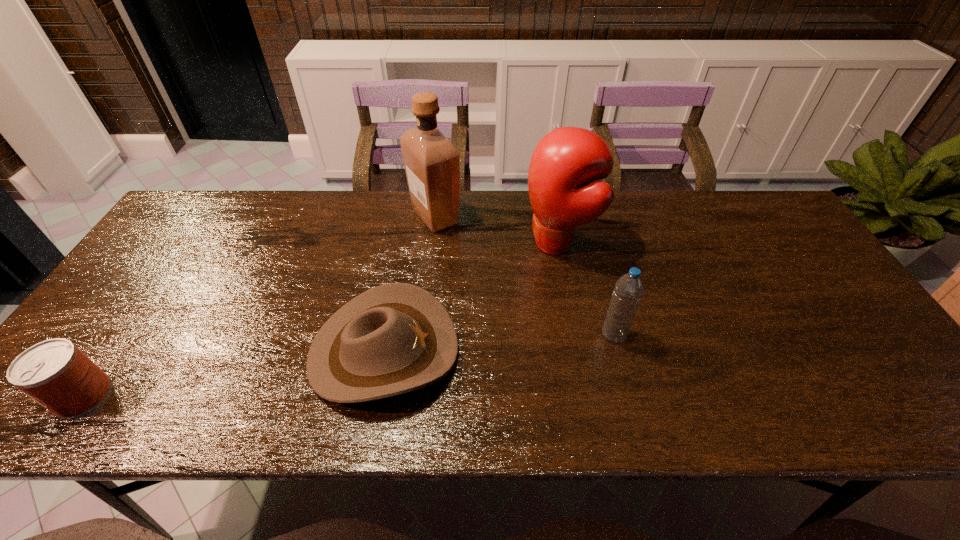
The image size is (960, 540). What are the coordinates of `liquor` in the screenshot? It's located at (432, 162).

Where is `boxing glove`? The width and height of the screenshot is (960, 540). boxing glove is located at coordinates (565, 161).

Where is `the third tallest object`? Image resolution: width=960 pixels, height=540 pixels. the third tallest object is located at coordinates (628, 291).

You are a GUI agent. You are given a task and a screenshot of the screen. Output one action in this format:
    pyautogui.click(x=<x>, y=<y>)
    Task: Click on the leftmost object
    The width and height of the screenshot is (960, 540).
    Given the screenshot: What is the action you would take?
    click(55, 373)

The width and height of the screenshot is (960, 540). What are the coordinates of `cowboy hat` in the screenshot? It's located at (395, 338).

The image size is (960, 540). Identify the location of free space located 0.180m on the front-facing side of the liquor. (520, 217).

This screenshot has width=960, height=540. I want to click on free space located on the striking surface of the boxing glove, so click(414, 244).

The height and width of the screenshot is (540, 960). In order to click on free space located on the striking surface of the boxing glove in this screenshot , I will do `click(451, 244)`.

Where is `vacant area situated 0.240m on the striking surface of the boxing glove`? Image resolution: width=960 pixels, height=540 pixels. vacant area situated 0.240m on the striking surface of the boxing glove is located at coordinates (441, 244).

What are the coordinates of `vacant space located 0.310m on the back of the water bottle` in the screenshot? It's located at pyautogui.click(x=589, y=241).